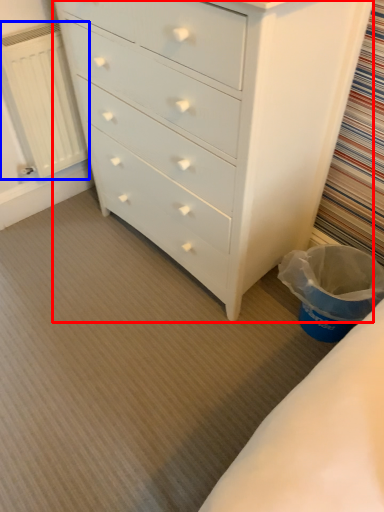
Question: Among these objects, which one is nearest to the camera, chest of drawers (highlighted by a red box) or radiator (highlighted by a blue box)?

Choices:
 (A) chest of drawers
 (B) radiator

Answer: (A)